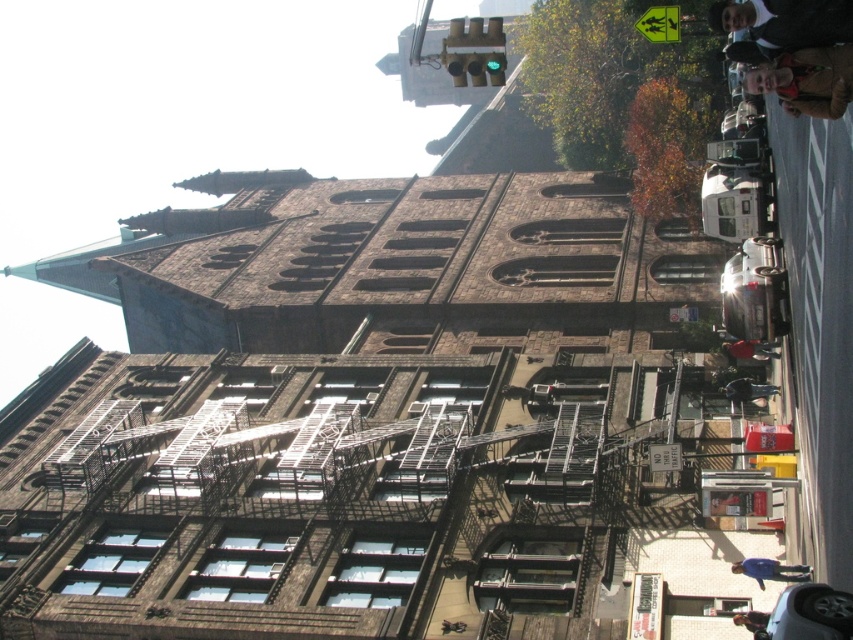
You are standing on the street in front of the historic stone building and want to walk towards the point marked as point [764,396] and point [750,620]. Which point will you reach first?

You will reach point [764,396] first because it is closer to you than point [750,620], which is further away.

You are a fashion designer observing the street scene. You notice two jackets in the image. Which one is taller, the light brown leather jacket at upper right or the brown leather jacket at lower right?

The light brown leather jacket at upper right is taller than the brown leather jacket at lower right.

You are a delivery person trying to deliver a package to the historic stone building. You notice two jackets hanging on a fire escape at the upper right corner of the building. The jackets are a dark brown leather jacket at upper right and a light brown leather jacket at upper right. Which jacket is positioned higher on the fire escape?

The dark brown leather jacket at upper right is located above the light brown leather jacket at upper right, so it is positioned higher on the fire escape.